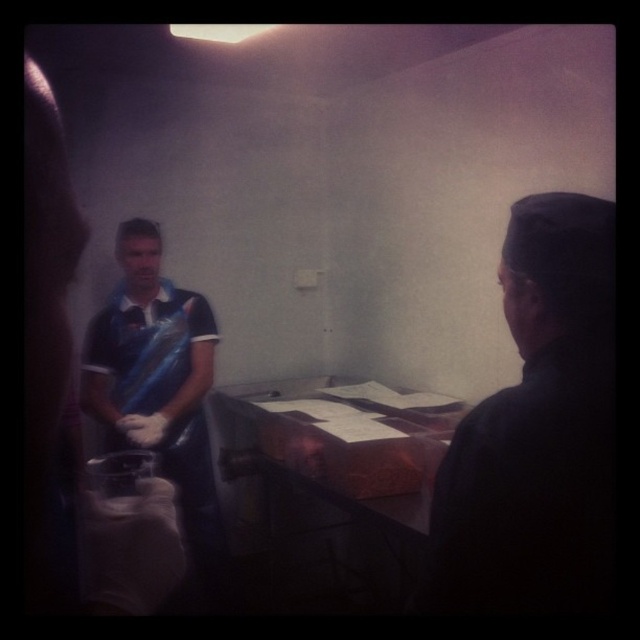
Based on the photo, you are a healthcare worker entering the room and need to locate both the dark matte cap at right and the blue plastic bag at left. Based on their positions, which object is higher up in the image?

The dark matte cap at right is above the blue plastic bag at left, so it is higher up in the image.

You are a delivery person who just arrived at the medical facility. You see a point at coordinate (x=538, y=432). Where is this point located?

The point at coordinate (x=538, y=432) is located on the dark matte cap at right.

You are a healthcare worker in the room and need to access both the dark matte cap at right and the blue plastic bag at left. Which object will you reach first if you move directly towards them?

The dark matte cap at right is closer to the viewer than the blue plastic bag at left, so you will reach the dark matte cap at right first.